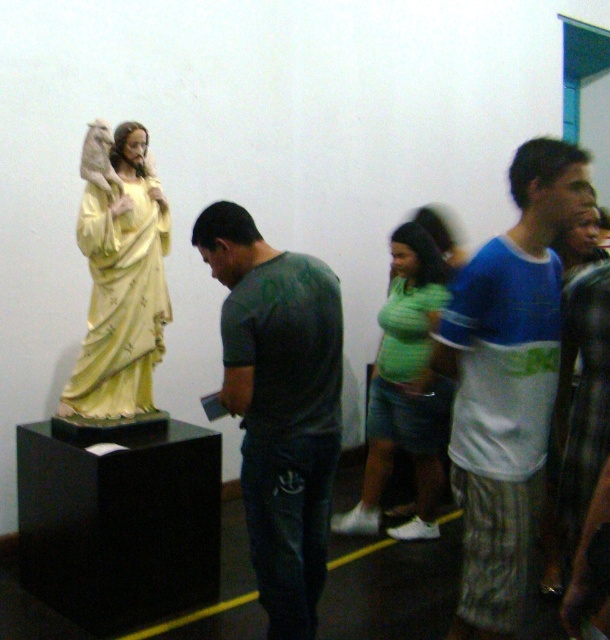
Question: In this image, where is white cotton shirt at center located relative to matte yellow statue at left?

Choices:
 (A) right
 (B) left

Answer: (A)

Question: Which point is closer to the camera?

Choices:
 (A) dark green t-shirt at center
 (B) green striped shirt at center
 (C) matte yellow statue at left
 (D) white cotton shirt at center

Answer: (D)

Question: Considering the real-world distances, which object is closest to the green striped shirt at center?

Choices:
 (A) white cotton shirt at center
 (B) matte yellow statue at left

Answer: (A)

Question: Can you confirm if dark green t-shirt at center is smaller than matte yellow statue at left?

Choices:
 (A) yes
 (B) no

Answer: (B)

Question: Considering the relative positions of white cotton shirt at center and green striped shirt at center in the image provided, where is white cotton shirt at center located with respect to green striped shirt at center?

Choices:
 (A) right
 (B) left

Answer: (A)

Question: Which point is closer to the camera?

Choices:
 (A) (547, 404)
 (B) (339, 394)

Answer: (A)